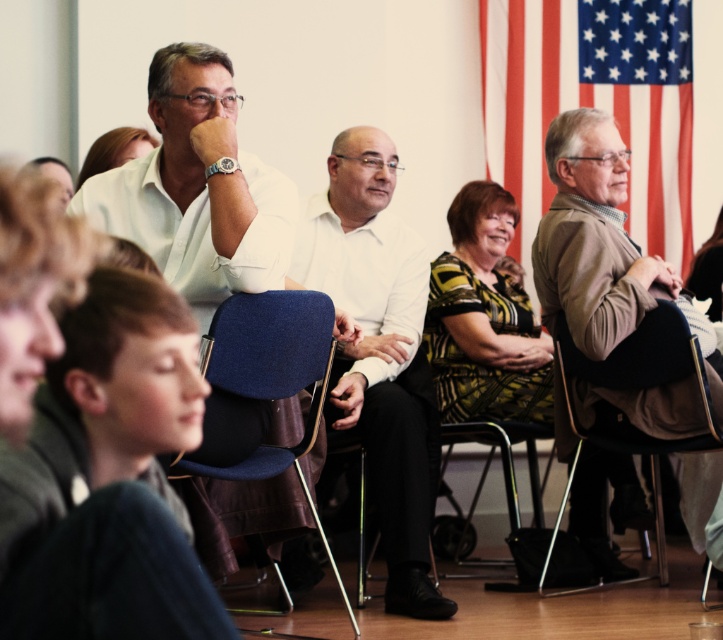
Question: Which point is farther to the camera?

Choices:
 (A) blue fabric chair at center
 (B) white matte shirt at center
 (C) white smooth shirt at center
 (D) american flag at upper right

Answer: (D)

Question: Among these points, which one is farthest from the camera?

Choices:
 (A) (98, 634)
 (B) (389, 552)
 (C) (662, 250)

Answer: (C)

Question: Considering the real-world distances, which object is closest to the white matte shirt at center?

Choices:
 (A) american flag at upper right
 (B) printed fabric dress at center

Answer: (B)

Question: Does white matte shirt at center have a lesser width compared to matte white shirt at upper center?

Choices:
 (A) yes
 (B) no

Answer: (B)

Question: Can you confirm if blue fabric chair at center is positioned above black leather chair at center?

Choices:
 (A) no
 (B) yes

Answer: (A)

Question: Is american flag at upper right to the right of blue fabric chair at center from the viewer's perspective?

Choices:
 (A) no
 (B) yes

Answer: (B)